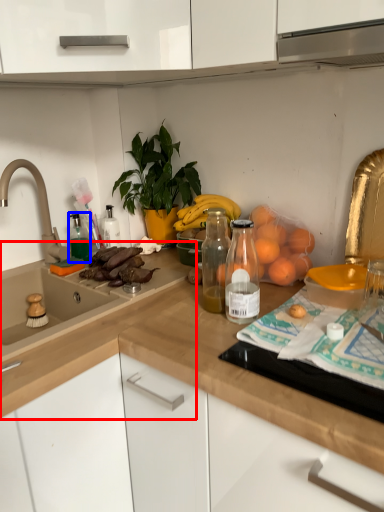
Question: Which of the following is the farthest to the observer, countertop (highlighted by a red box) or bottle (highlighted by a blue box)?

Choices:
 (A) countertop
 (B) bottle

Answer: (B)